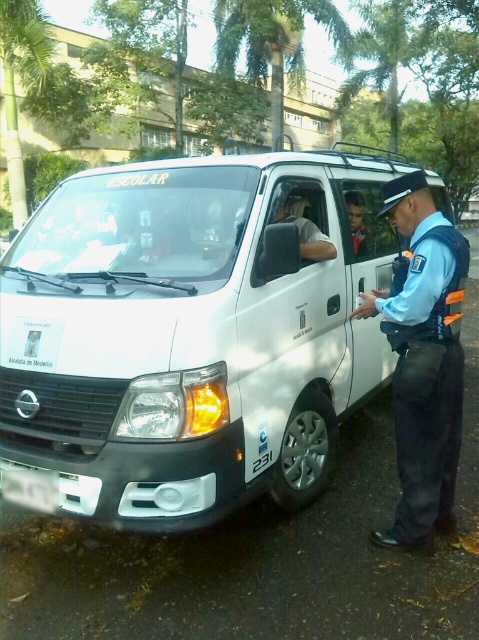
Question: Considering the relative positions of white matte van at center and white plastic license plate at lower left in the image provided, where is white matte van at center located with respect to white plastic license plate at lower left?

Choices:
 (A) right
 (B) left

Answer: (A)

Question: In this image, where is blue uniform at right located relative to white plastic license plate at lower left?

Choices:
 (A) above
 (B) below

Answer: (A)

Question: Which point is farther from the camera taking this photo?

Choices:
 (A) (309, 225)
 (B) (433, 378)
 (C) (355, 195)
 (D) (9, 467)

Answer: (C)

Question: Which point is closer to the camera?

Choices:
 (A) white matte van at center
 (B) smooth skin face at center

Answer: (A)

Question: Which of the following is the farthest from the observer?

Choices:
 (A) (274, 195)
 (B) (399, 182)
 (C) (361, 209)

Answer: (C)

Question: Can you confirm if white plastic license plate at lower left is wider than smooth skin face at center?

Choices:
 (A) no
 (B) yes

Answer: (B)